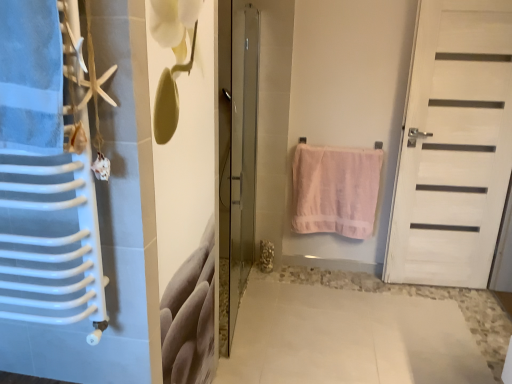
Question: Considering the positions of pink cotton towel at center and transparent glass door at center, marked as the second door in a right-to-left arrangement, in the image, is pink cotton towel at center bigger or smaller than transparent glass door at center, marked as the second door in a right-to-left arrangement,?

Choices:
 (A) big
 (B) small

Answer: (B)

Question: In terms of width, does pink cotton towel at center look wider or thinner when compared to transparent glass door at center, marked as the second door in a right-to-left arrangement?

Choices:
 (A) thin
 (B) wide

Answer: (A)

Question: Which object is positioned farthest from the white matte door at right, the 1th door in the right-to-left sequence?

Choices:
 (A) pink cotton towel at center
 (B) transparent glass door at center, marked as the second door in a right-to-left arrangement

Answer: (B)

Question: Which object is the farthest from the pink cotton towel at center?

Choices:
 (A) white matte door at right, the 1th door in the right-to-left sequence
 (B) transparent glass door at center, marked as the second door in a right-to-left arrangement

Answer: (B)